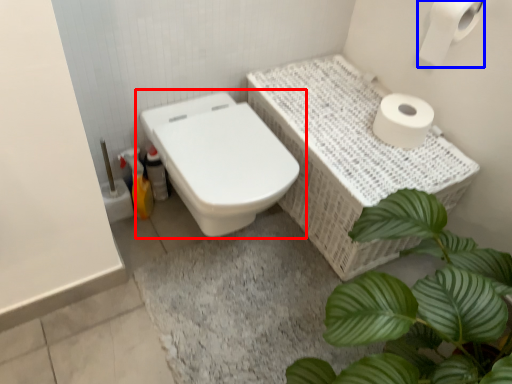
Question: Which object appears closest to the camera in this image, toilet (highlighted by a red box) or toilet paper (highlighted by a blue box)?

Choices:
 (A) toilet
 (B) toilet paper

Answer: (B)